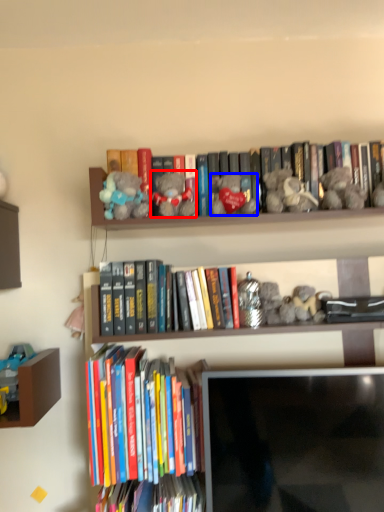
Question: Among these objects, which one is farthest to the camera, toy (highlighted by a red box) or toy (highlighted by a blue box)?

Choices:
 (A) toy
 (B) toy

Answer: (B)